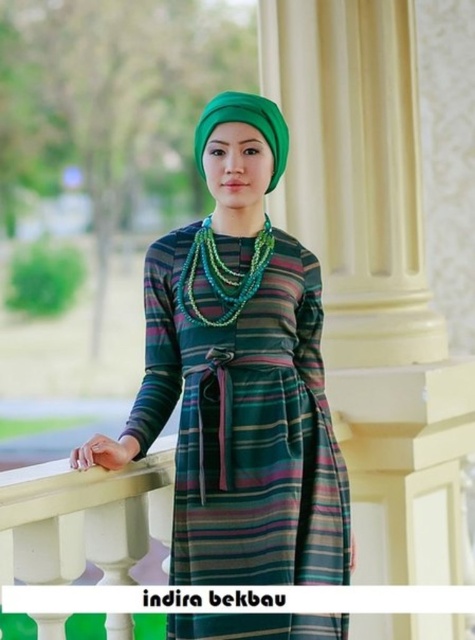
Question: Is the position of white painted wood at center more distant than that of green felt hat at upper center?

Choices:
 (A) yes
 (B) no

Answer: (B)

Question: Estimate the real-world distances between objects in this image. Which object is closer to the green beaded necklace at center?

Choices:
 (A) green felt hat at upper center
 (B) white painted wood at center

Answer: (A)

Question: Among these points, which one is farthest from the camera?

Choices:
 (A) (228, 116)
 (B) (210, 266)

Answer: (B)

Question: Does green beaded necklace at center appear over green felt hat at upper center?

Choices:
 (A) yes
 (B) no

Answer: (B)

Question: Among these points, which one is farthest from the camera?

Choices:
 (A) (196, 164)
 (B) (325, 515)

Answer: (A)

Question: Is striped fabric dress at center to the left of white painted wood at center from the viewer's perspective?

Choices:
 (A) no
 (B) yes

Answer: (B)